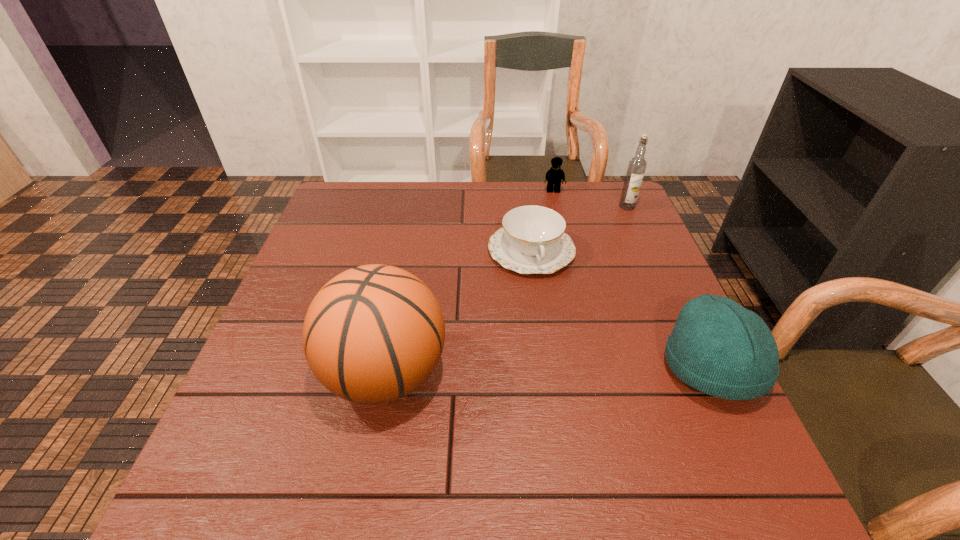
Identify the location of vacant space on the desktop that is between the leftmost object and the third shortest object and is positioned on the handle side of the shortest object. Image resolution: width=960 pixels, height=540 pixels. (571, 370).

Image resolution: width=960 pixels, height=540 pixels. I want to click on free space on the desktop that is between the basketball and the third shortest object and is positioned on the front-facing side of the Lego, so click(588, 370).

The height and width of the screenshot is (540, 960). Identify the location of vacant space on the desktop that is between the basketball and the third tallest object and is positioned on the label of the vodka. (553, 370).